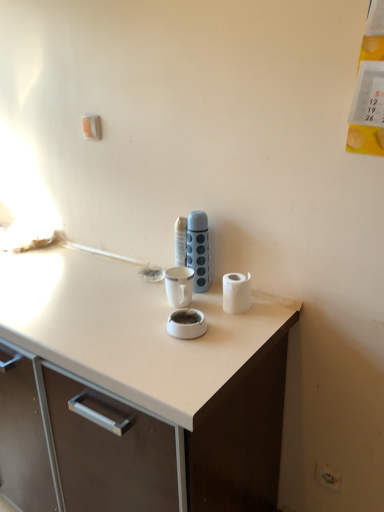
Question: Are white matte paper towel at right and blue textured thermos at center far apart?

Choices:
 (A) no
 (B) yes

Answer: (A)

Question: Is white matte paper towel at right outside of blue textured thermos at center?

Choices:
 (A) yes
 (B) no

Answer: (A)

Question: Considering the relative positions of white matte paper towel at right and blue textured thermos at center in the image provided, is white matte paper towel at right to the left of blue textured thermos at center from the viewer's perspective?

Choices:
 (A) yes
 (B) no

Answer: (B)

Question: Is white matte paper towel at right closer to the viewer compared to blue textured thermos at center?

Choices:
 (A) yes
 (B) no

Answer: (A)

Question: Considering the relative positions of white matte paper towel at right and blue textured thermos at center in the image provided, is white matte paper towel at right to the right of blue textured thermos at center from the viewer's perspective?

Choices:
 (A) yes
 (B) no

Answer: (A)

Question: Considering the relative sizes of white matte paper towel at right and blue textured thermos at center in the image provided, is white matte paper towel at right smaller than blue textured thermos at center?

Choices:
 (A) yes
 (B) no

Answer: (A)

Question: Is blue textured thermos at center smaller than white matte paper towel at right?

Choices:
 (A) yes
 (B) no

Answer: (B)

Question: From the image's perspective, does blue textured thermos at center appear higher than white matte paper towel at right?

Choices:
 (A) no
 (B) yes

Answer: (B)

Question: Can you confirm if blue textured thermos at center is shorter than white matte paper towel at right?

Choices:
 (A) yes
 (B) no

Answer: (B)

Question: Is blue textured thermos at center not within white matte paper towel at right?

Choices:
 (A) no
 (B) yes

Answer: (B)

Question: Is blue textured thermos at center wider than white matte paper towel at right?

Choices:
 (A) yes
 (B) no

Answer: (B)

Question: Considering the relative sizes of blue textured thermos at center and white matte paper towel at right in the image provided, is blue textured thermos at center thinner than white matte paper towel at right?

Choices:
 (A) yes
 (B) no

Answer: (A)

Question: Considering the relative sizes of white plastic electric outlet at lower right and blue textured thermos at center in the image provided, is white plastic electric outlet at lower right thinner than blue textured thermos at center?

Choices:
 (A) yes
 (B) no

Answer: (A)